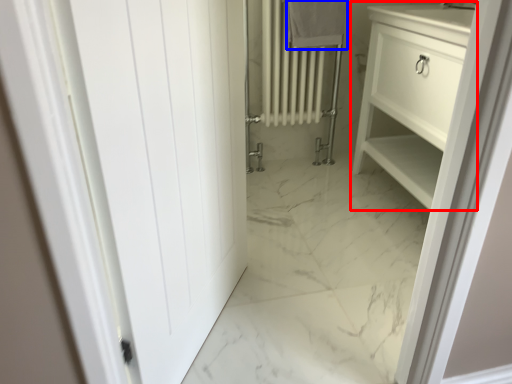
Question: Among these objects, which one is farthest to the camera, bathroom cabinet (highlighted by a red box) or bath towel (highlighted by a blue box)?

Choices:
 (A) bathroom cabinet
 (B) bath towel

Answer: (B)